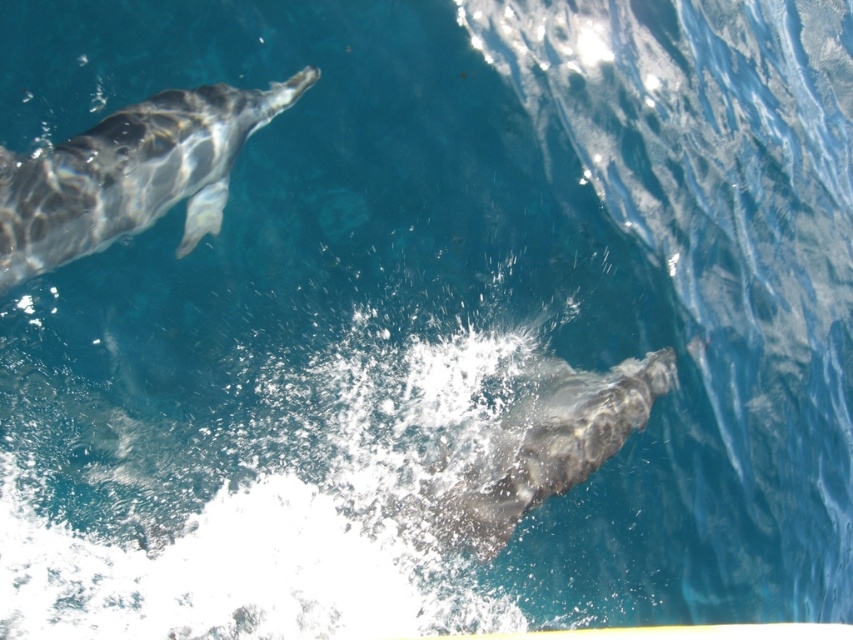
In the scene shown: You are a marine biologist observing two dolphins in the ocean. You notice the gray shiny dolphin at upper left and the gray textured dolphin at lower right. Which dolphin is wider?

The gray textured dolphin at lower right is wider than the gray shiny dolphin at upper left.

You are a marine biologist observing two dolphins in the ocean. You notice the gray shiny dolphin at upper left and the gray textured dolphin at lower right. Based on their positions, which dolphin is closer to the water surface?

The gray shiny dolphin at upper left is closer to the water surface because it is positioned above the gray textured dolphin at lower right.

You are a marine biologist observing two points in the ocean where dolphins were spotted. The points are labeled as point (33, 244) and point (543, 436). Based on your observations, which point is closer to the observer?

Point (33, 244) is in front of point (543, 436), so it is closer to the observer.